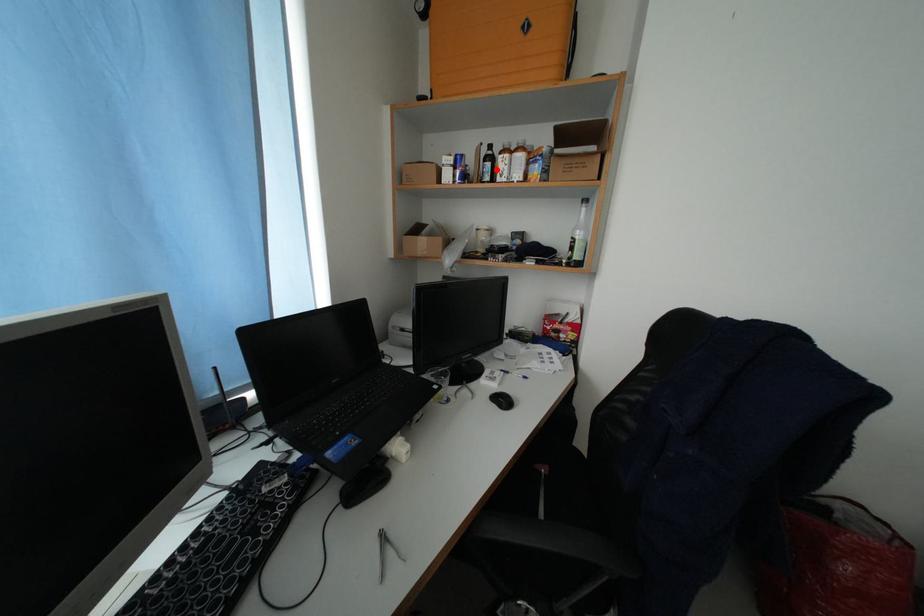
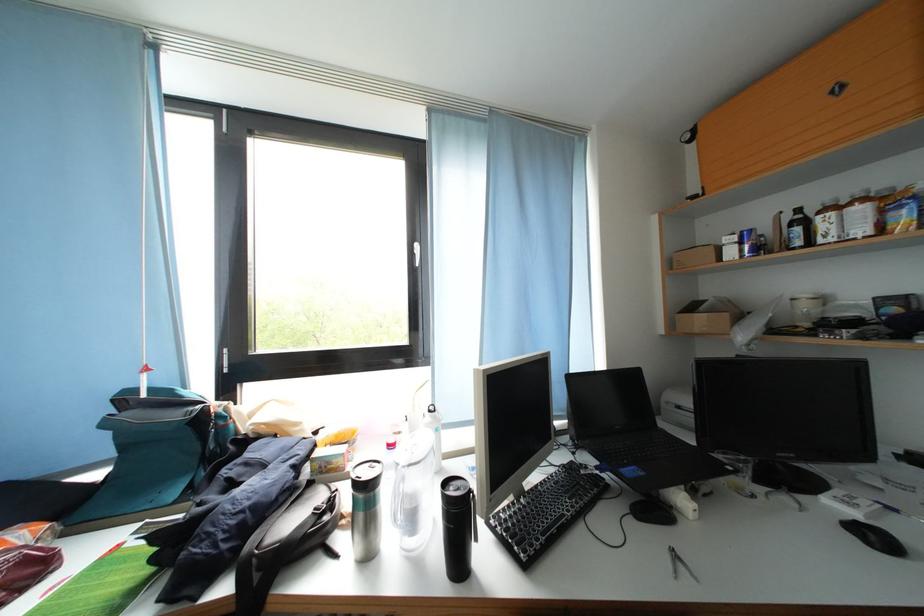
In the second image, find the point that corresponds to the highlighted location in the first image.

(806, 233)